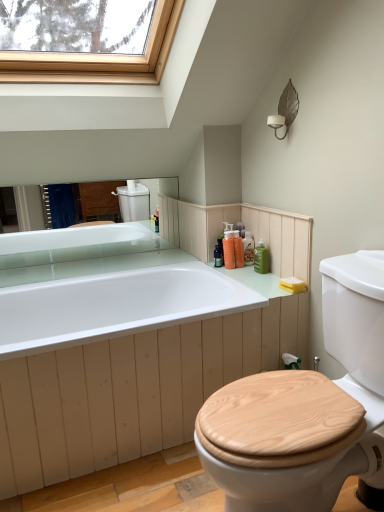
Find the location of a particular element. free space in front of translucent orange soap at upper right, positioned as the 2th toiletry in left-to-right order is located at coordinates (252, 269).